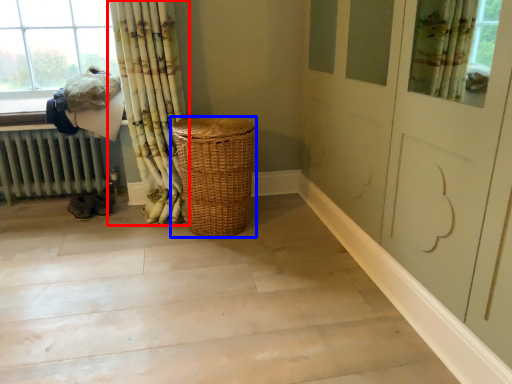
Question: Which object appears closest to the camera in this image, curtain (highlighted by a red box) or basket (highlighted by a blue box)?

Choices:
 (A) curtain
 (B) basket

Answer: (A)